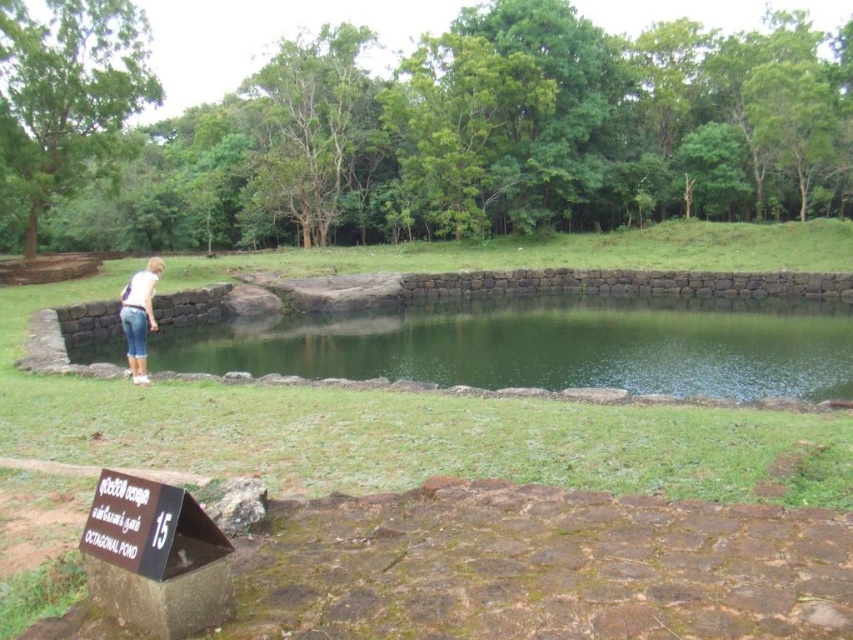
You are standing at the edge of the Octagonal Pond and see the point marked at coordinates [543,346]. What is the nature of the surface at that point?

The point at coordinates [543,346] is on green smooth water at center, so the surface there is smooth.